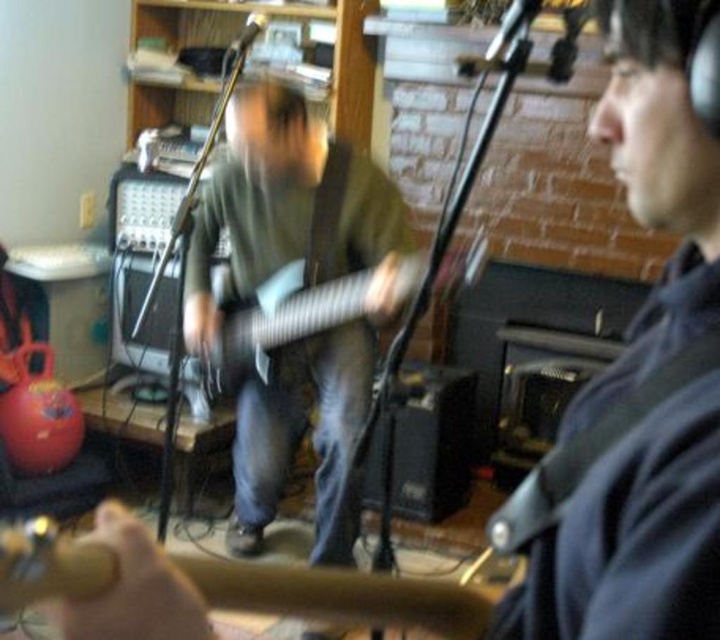
You are a photographer setting up for a photo shoot in the music studio. You need to position a spotlight so that it illuminates both the dark blue shirt at center and the wooden acoustic guitar at center without casting shadows on the brick wall behind. Considering their heights, which object should the spotlight be aimed at first to ensure proper lighting?

The dark blue shirt at center has a greater height compared to the wooden acoustic guitar at center. Therefore, the spotlight should be aimed at the dark blue shirt at center first to ensure it is properly lit, and then adjusted to cover the guitar as well.

You are a photographer in the music studio and want to take a closeup of the dark blue shirt at center. Where should you point your camera?

You should point your camera at point 0.597 on the x axis and 0.887 on the y axis to capture the dark blue shirt at center.